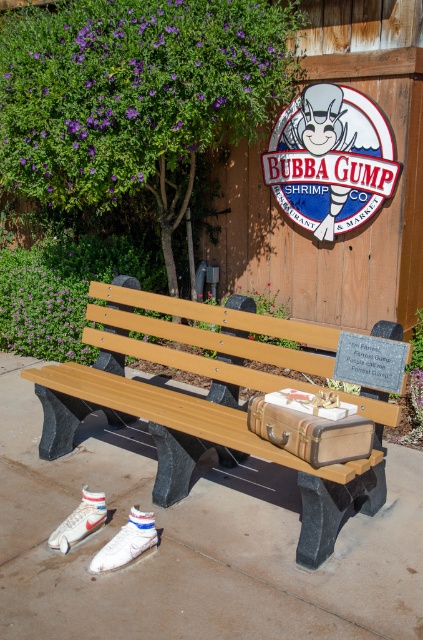
Question: Does wooden signboard at upper center have a lesser width compared to white leather shoe at lower left?

Choices:
 (A) no
 (B) yes

Answer: (A)

Question: Can you confirm if wooden bench at center is positioned to the right of white leather shoe at lower left?

Choices:
 (A) yes
 (B) no

Answer: (A)

Question: Estimate the real-world distances between objects in this image. Which object is closer to the white suede shoe at lower left?

Choices:
 (A) white leather shoe at lower left
 (B) wooden signboard at upper center
 (C) wooden bench at center

Answer: (A)

Question: Among these points, which one is farthest from the camera?

Choices:
 (A) (354, 131)
 (B) (129, 556)
 (C) (65, 538)
 (D) (41, 369)

Answer: (A)

Question: Is the position of wooden bench at center less distant than that of white suede shoe at lower left?

Choices:
 (A) no
 (B) yes

Answer: (B)

Question: Which of the following is the closest to the observer?

Choices:
 (A) white leather shoe at lower left
 (B) white suede shoe at lower left
 (C) wooden signboard at upper center

Answer: (B)